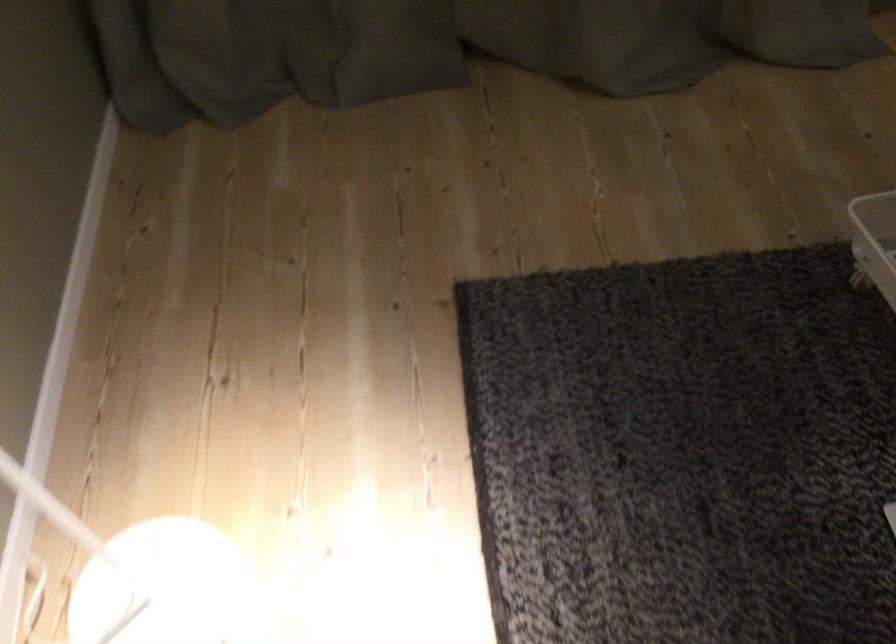
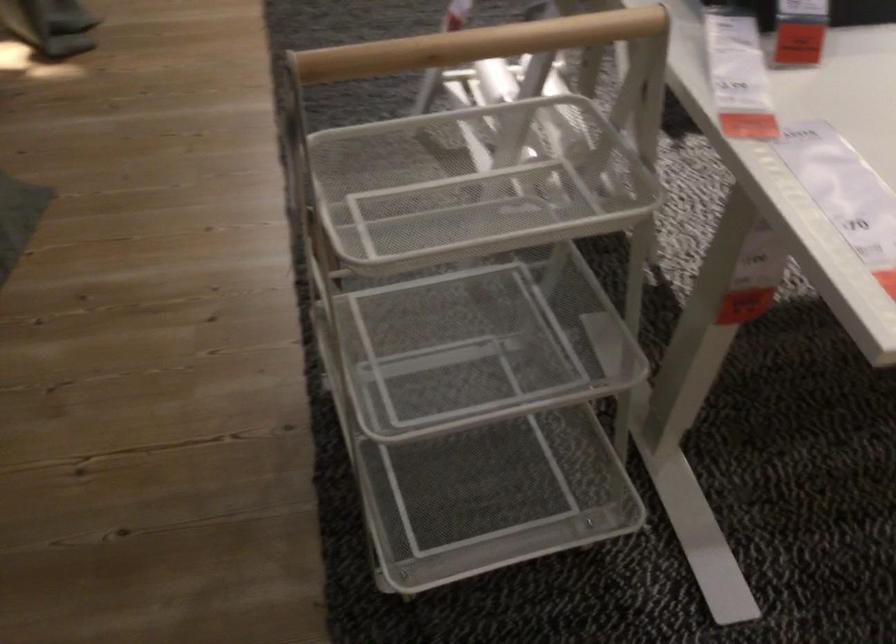
The images are taken continuously from a first-person perspective. In which direction is your viewpoint rotating?

The camera rotated toward right-down.